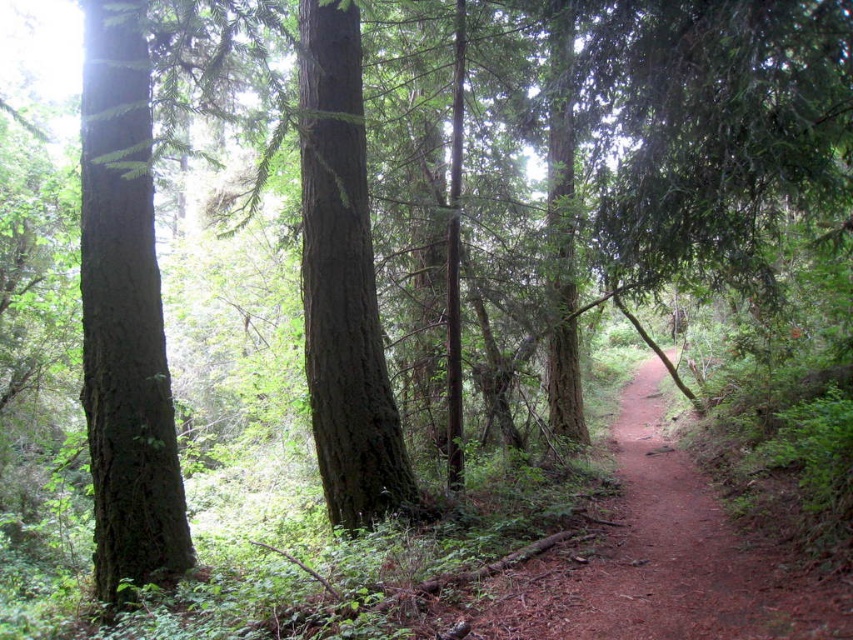
You are a hiker carrying a 2.5 meter long wooden beam. You come across the dirt path at center and the smooth brown tree trunk at center. Which one is wider so you can carry the beam through without hitting the tree trunk?

The dirt path at center is wider than the smooth brown tree trunk at center, so you can carry the beam through the dirt path at center without hitting the tree trunk.

You are a hiker walking along the narrow dirt path in the forest. You notice a green rough bark tree at left and a smooth brown tree trunk at center. Which tree is closer to the left edge of the path?

The green rough bark tree at left is closer to the left edge of the path because it is positioned on the left side of the smooth brown tree trunk at center.

You are a hiker trying to navigate a narrow dirt path in a forest. You see a green rough bark tree at left and a smooth brown tree trunk at center. Which tree would you need to look up higher to see the top of?

The green rough bark tree at left is much taller than the smooth brown tree trunk at center, so you would need to look up higher to see the top of the green rough bark tree at left.